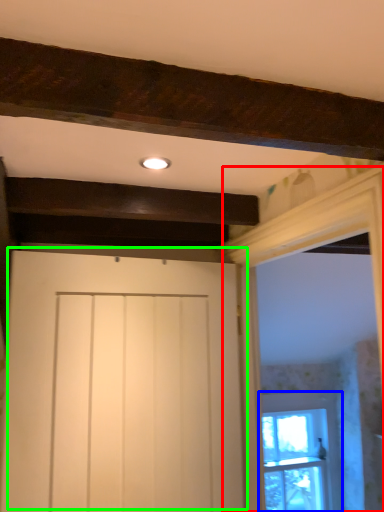
Question: Estimate the real-world distances between objects in this image. Which object is farther from window frame (highlighted by a red box), window (highlighted by a blue box) or door (highlighted by a green box)?

Choices:
 (A) window
 (B) door

Answer: (A)